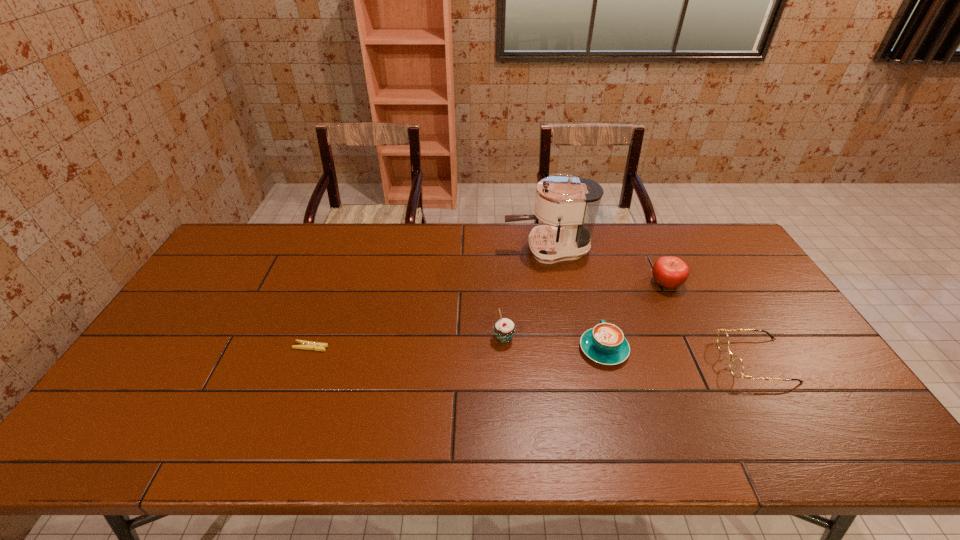
Identify the location of free spot located on the front-facing side of the coffee maker. The image size is (960, 540). (458, 249).

This screenshot has width=960, height=540. I want to click on blank space located 0.290m on the front-facing side of the coffee maker, so click(420, 249).

I want to click on free space located on the front of the apple, so click(695, 344).

Where is `vacant space situated on the back of the cupcake`? This screenshot has height=540, width=960. vacant space situated on the back of the cupcake is located at coordinates [500, 273].

This screenshot has height=540, width=960. What are the coordinates of `vacant space located 0.080m with the handle on the right side of the cappuccino` in the screenshot? It's located at (593, 311).

Where is `free space located 0.100m with the handle on the right side of the cappuccino`? free space located 0.100m with the handle on the right side of the cappuccino is located at coordinates (592, 307).

At what (x,y) coordinates should I click in order to perform the action: click on free space located with the handle on the right side of the cappuccino. Please return your answer as a coordinate pair (x, y). Looking at the image, I should click on (592, 307).

Locate an element on the screen. vacant space located 0.340m on the lenses of the rightmost object is located at coordinates (596, 361).

At what (x,y) coordinates should I click in order to perform the action: click on vacant space located 0.060m on the lenses of the rightmost object. Please return your answer as a coordinate pair (x, y). Looking at the image, I should click on (701, 361).

The image size is (960, 540). I want to click on vacant region located 0.280m on the lenses of the rightmost object, so click(619, 361).